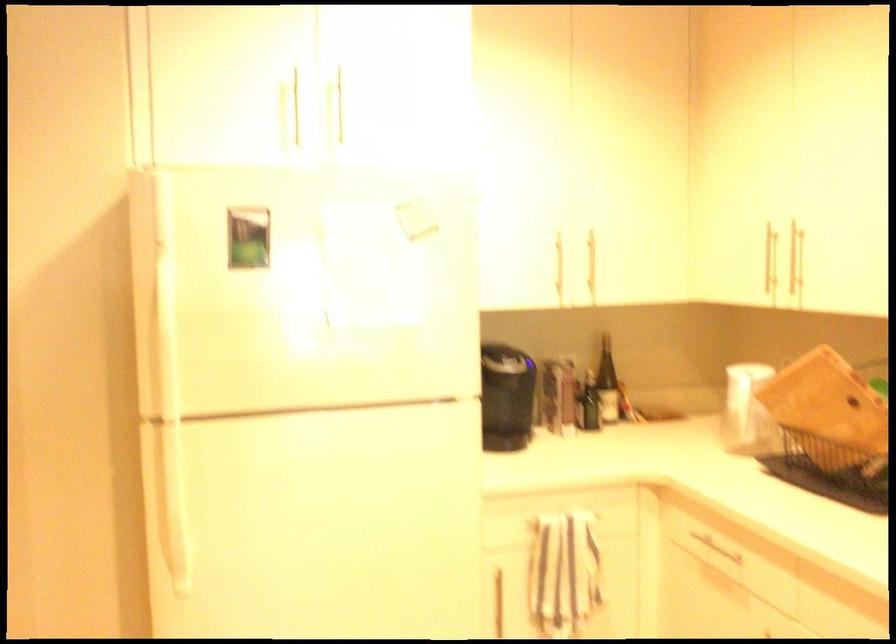
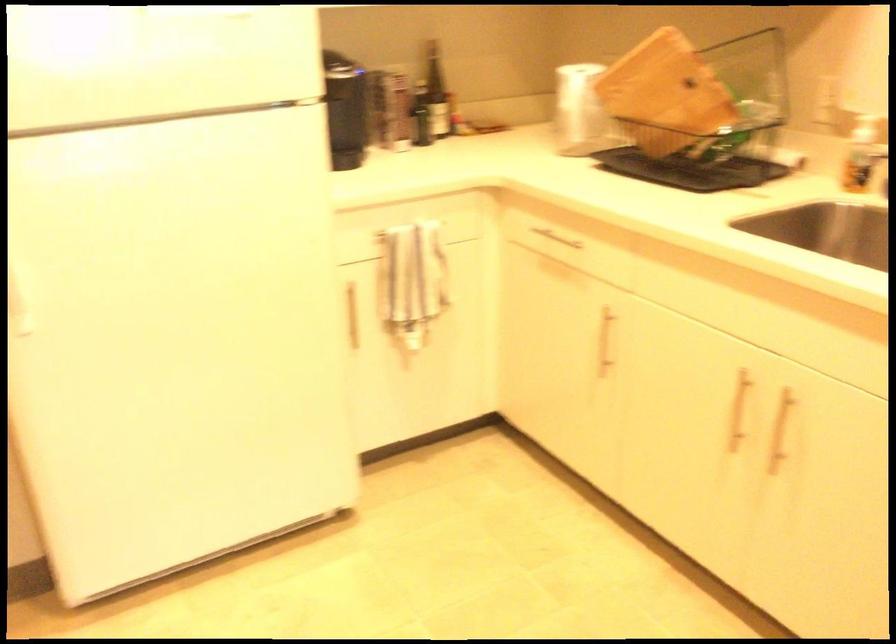
Locate, in the second image, the point that corresponds to point 719,551 in the first image.

(554, 238)